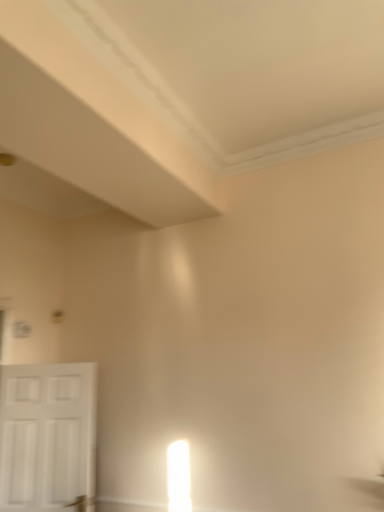
What do you see at coordinates (47, 435) in the screenshot? I see `white matte door at lower left` at bounding box center [47, 435].

This screenshot has height=512, width=384. I want to click on white matte door at lower left, so click(x=47, y=435).

Where is `white matte door at lower left`? This screenshot has width=384, height=512. white matte door at lower left is located at coordinates (47, 435).